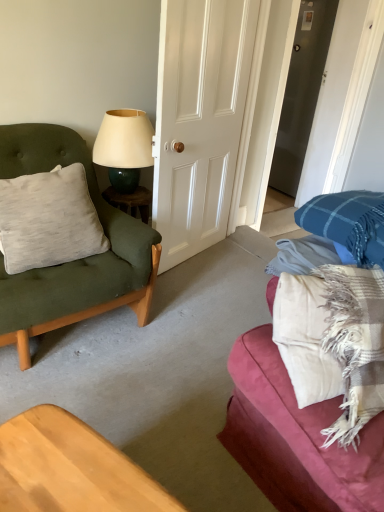
Question: Is matte green cushion at left taller or shorter than white glossy door at center?

Choices:
 (A) short
 (B) tall

Answer: (A)

Question: From the image's perspective, is matte green cushion at left positioned above or below white glossy door at center?

Choices:
 (A) below
 (B) above

Answer: (A)

Question: Which is farther from the plaid fabric couch at right?

Choices:
 (A) white glossy door at center
 (B) light gray cotton pillow at left
 (C) matte cream lampshade at upper center
 (D) matte green cushion at left

Answer: (A)

Question: Which of these objects is positioned farthest from the light gray cotton pillow at left?

Choices:
 (A) matte cream lampshade at upper center
 (B) plaid fabric couch at right
 (C) white glossy door at center
 (D) matte green cushion at left

Answer: (B)